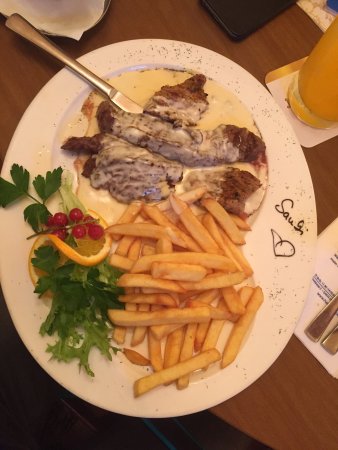
This screenshot has height=450, width=338. Identify the location of butter knife. (88, 75).